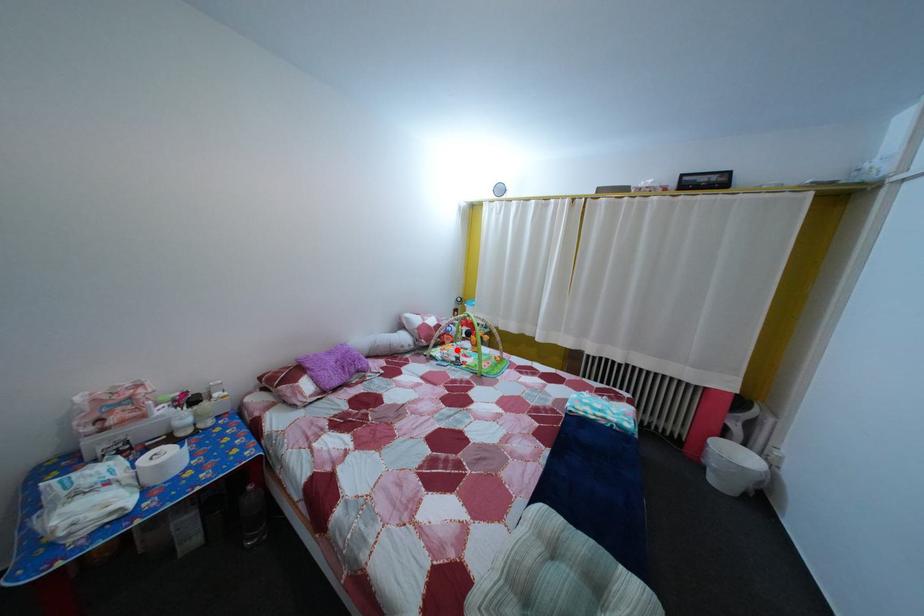
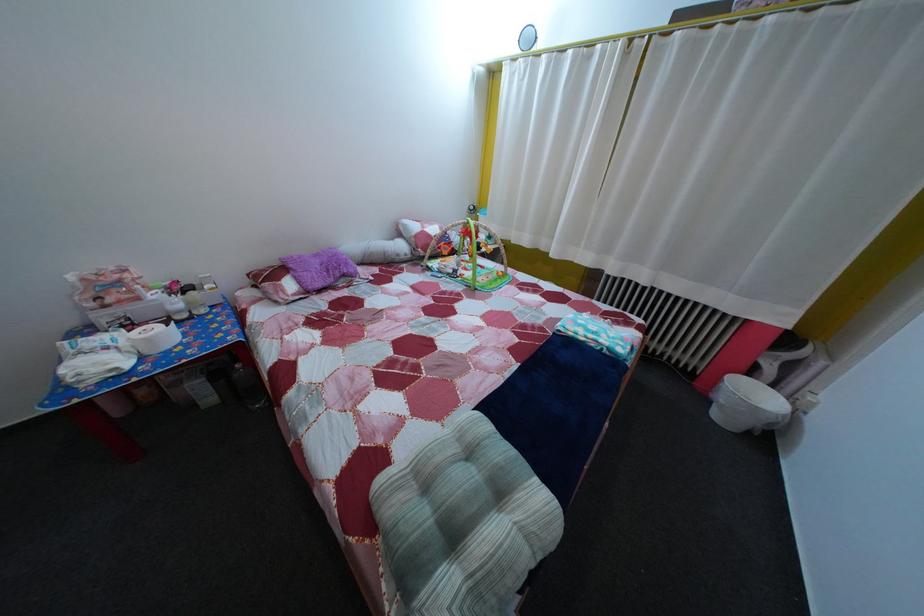
Find the pixel in the second image that matches the highlighted location in the first image.

(455, 261)